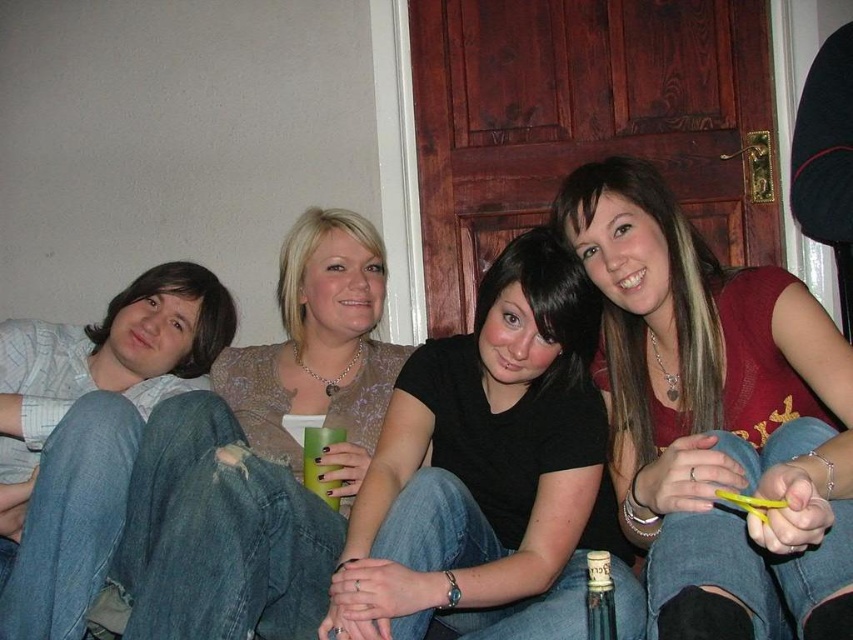
Can you confirm if translucent glass bottle at lower center is smaller than green matte cup at center?

Actually, translucent glass bottle at lower center might be larger than green matte cup at center.

Is point (589, 579) closer to viewer compared to point (318, 493)?

Yes, point (589, 579) is in front of point (318, 493).

I want to click on translucent glass bottle at lower center, so click(599, 596).

Does matte red sweater at center appear on the right side of green matte cup at center?

Indeed, matte red sweater at center is positioned on the right side of green matte cup at center.

Who is lower down, matte red sweater at center or green matte cup at center?

green matte cup at center

The width and height of the screenshot is (853, 640). What do you see at coordinates (717, 419) in the screenshot? I see `matte red sweater at center` at bounding box center [717, 419].

Locate an element on the screen. The height and width of the screenshot is (640, 853). matte red sweater at center is located at coordinates (717, 419).

Between point (782, 314) and point (610, 563), which one is positioned in front?

Point (782, 314) is in front.

The image size is (853, 640). What do you see at coordinates (717, 419) in the screenshot?
I see `matte red sweater at center` at bounding box center [717, 419].

This screenshot has height=640, width=853. I want to click on matte red sweater at center, so pos(717,419).

The height and width of the screenshot is (640, 853). I want to click on matte red sweater at center, so pos(717,419).